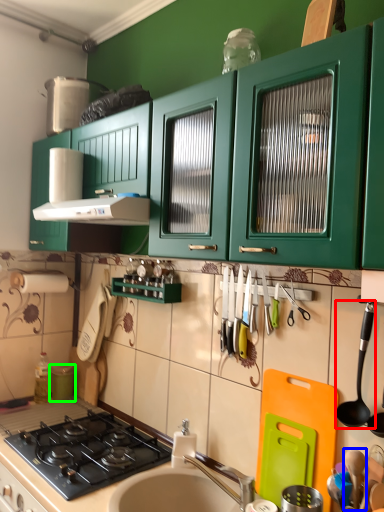
Question: Considering the real-world distances, which object is farthest from utensil (highlighted by a red box)? utensil (highlighted by a blue box) or appliance (highlighted by a green box)?

Choices:
 (A) utensil
 (B) appliance

Answer: (B)